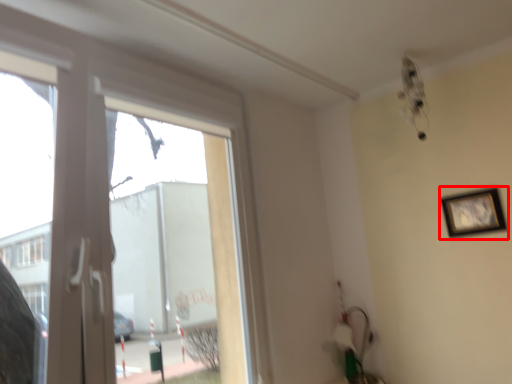
Question: From the image's perspective, considering the relative positions of picture frame (annotated by the red box) and window in the image provided, where is picture frame (annotated by the red box) located with respect to the staircase?

Choices:
 (A) above
 (B) below

Answer: (A)